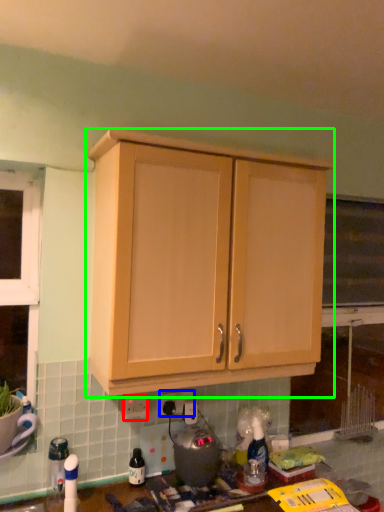
Question: Which is farther away from electric outlet (highlighted by a red box)? electric outlet (highlighted by a blue box) or cabinetry (highlighted by a green box)?

Choices:
 (A) electric outlet
 (B) cabinetry

Answer: (B)